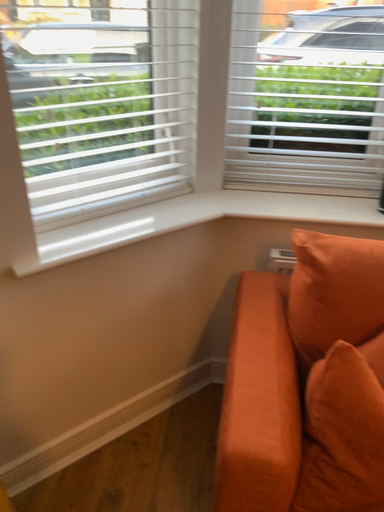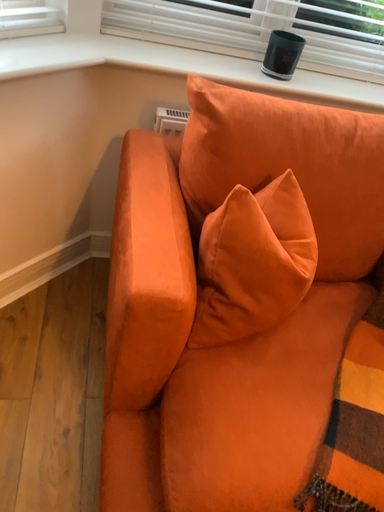
Question: Which way did the camera rotate in the video?

Choices:
 (A) rotated left
 (B) rotated right

Answer: (B)